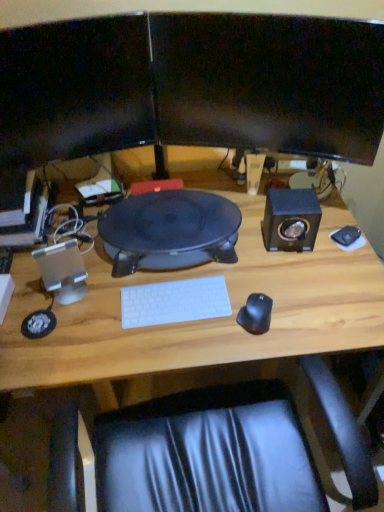
Question: From a real-world perspective, is black glossy monitor at upper center, marked as the 1th computer monitor in a right-to-left arrangement, physically located above or below silver metallic speaker at left, arranged as the 2th speaker when viewed from the top?

Choices:
 (A) below
 (B) above

Answer: (B)

Question: Is black glossy monitor at upper center, marked as the 1th computer monitor in a right-to-left arrangement, to the left or to the right of silver metallic speaker at left, which is the 2th speaker from right to left, in the image?

Choices:
 (A) right
 (B) left

Answer: (A)

Question: Considering the real-world distances, which object is farthest from the silver metallic speaker at left, which appears as the 1th speaker when ordered from the bottom?

Choices:
 (A) white plastic keyboard at center
 (B) matte black speaker at center
 (C) metallic silver computer at left
 (D) black rubberized mouse at right, the 1th mouse when ordered from front to back
 (E) black matte speaker at right, arranged as the first speaker when viewed from the top

Answer: (E)

Question: Which object is the closest to the white plastic keyboard at center?

Choices:
 (A) silver metallic speaker at left, which appears as the 1th speaker when ordered from the bottom
 (B) metallic silver computer at left
 (C) matte black monitor at upper center, which appears as the first computer monitor when viewed from the left
 (D) black matte speaker at right, which is the 2th speaker from left to right
 (E) matte black speaker at center

Answer: (E)